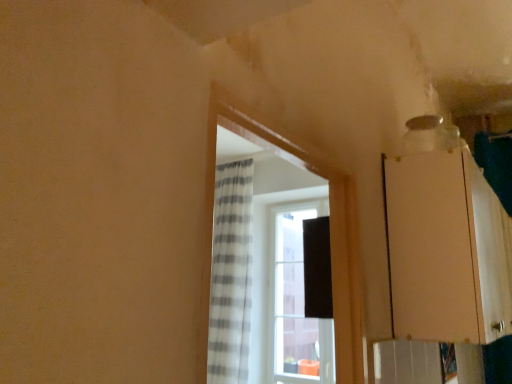
At what (x,y) coordinates should I click in order to perform the action: click on matte wood cabinet at right. Please return your answer as a coordinate pair (x, y). The height and width of the screenshot is (384, 512). Looking at the image, I should click on (446, 249).

From the picture: In order to face matte wood cabinet at right, should I rotate leftwards or rightwards?

To face it directly, rotate right by 27.387 degrees.

What do you see at coordinates (446, 249) in the screenshot? I see `matte wood cabinet at right` at bounding box center [446, 249].

Measure the distance between white striped curtain at center and camera.

white striped curtain at center is 29.41 inches from camera.

Identify the location of white striped curtain at center. coord(345,277).

What do you see at coordinates (345, 277) in the screenshot? I see `white striped curtain at center` at bounding box center [345, 277].

Locate an element on the screen. Image resolution: width=512 pixels, height=384 pixels. matte wood cabinet at right is located at coordinates (446, 249).

Looking at this image, considering the relative positions of matte wood cabinet at right and white striped curtain at center in the image provided, is matte wood cabinet at right to the right of white striped curtain at center from the viewer's perspective?

Correct, you'll find matte wood cabinet at right to the right of white striped curtain at center.

Is matte wood cabinet at right closer to camera compared to white striped curtain at center?

No, it is behind white striped curtain at center.

Between point (462, 211) and point (334, 175), which one is positioned in front?

The point (334, 175) is closer to the camera.

From the image's perspective, which one is positioned lower, matte wood cabinet at right or white striped curtain at center?

From the image's view, matte wood cabinet at right is below.

From a real-world perspective, is matte wood cabinet at right above or below white striped curtain at center?

In terms of real-world spatial position, matte wood cabinet at right is above white striped curtain at center.

In the scene shown: Which of these two, matte wood cabinet at right or white striped curtain at center, is thinner?

Thinner between the two is white striped curtain at center.

Does matte wood cabinet at right have a lesser height compared to white striped curtain at center?

No.

Between matte wood cabinet at right and white striped curtain at center, which one has larger size?

matte wood cabinet at right is bigger.

Is white striped curtain at center located within matte wood cabinet at right?

No, white striped curtain at center is located outside of matte wood cabinet at right.

Is matte wood cabinet at right not close to white striped curtain at center?

No, matte wood cabinet at right is in close proximity to white striped curtain at center.

Is matte wood cabinet at right oriented towards white striped curtain at center?

No, matte wood cabinet at right is not facing towards white striped curtain at center.

How many degrees apart are the facing directions of matte wood cabinet at right and white striped curtain at center?

matte wood cabinet at right and white striped curtain at center are facing 180 degrees away from each other.

The image size is (512, 384). In order to click on cabinetry above the white striped curtain at center (from a real-world perspective) in this screenshot , I will do `click(446, 249)`.

Between white striped curtain at center and matte wood cabinet at right, which one appears on the right side from the viewer's perspective?

From the viewer's perspective, matte wood cabinet at right appears more on the right side.

Is the position of white striped curtain at center less distant than that of matte wood cabinet at right?

Yes, white striped curtain at center is closer to the viewer.

Between point (287, 144) and point (398, 180), which one is positioned in front?

Point (287, 144)

From the image's perspective, would you say white striped curtain at center is positioned over matte wood cabinet at right?

Indeed, from the image's perspective, white striped curtain at center is shown above matte wood cabinet at right.

From a real-world perspective, which object rests below the other?

In real-world perspective, white striped curtain at center is lower.

Which object is thinner, white striped curtain at center or matte wood cabinet at right?

white striped curtain at center.

Is white striped curtain at center taller than matte wood cabinet at right?

Incorrect, the height of white striped curtain at center is not larger of that of matte wood cabinet at right.

Considering the sizes of white striped curtain at center and matte wood cabinet at right in the image, is white striped curtain at center bigger or smaller than matte wood cabinet at right?

In the image, white striped curtain at center appears to be smaller than matte wood cabinet at right.

Is white striped curtain at center inside or outside of matte wood cabinet at right?

white striped curtain at center is located beyond the bounds of matte wood cabinet at right.

Looking at this image, is there a large distance between white striped curtain at center and matte wood cabinet at right?

No.

Is white striped curtain at center facing towards matte wood cabinet at right?

No, white striped curtain at center is not aimed at matte wood cabinet at right.

Can you tell me how much white striped curtain at center and matte wood cabinet at right differ in facing direction?

The facing directions of white striped curtain at center and matte wood cabinet at right are 180 degrees apart.

Find the location of a particular element. The image size is (512, 384). window in front of the matte wood cabinet at right is located at coordinates coord(345,277).

Where is `window above the matte wood cabinet at right (from the image's perspective)`? The width and height of the screenshot is (512, 384). window above the matte wood cabinet at right (from the image's perspective) is located at coordinates point(345,277).

Where is `window that is in front of the matte wood cabinet at right`? The width and height of the screenshot is (512, 384). window that is in front of the matte wood cabinet at right is located at coordinates (345, 277).